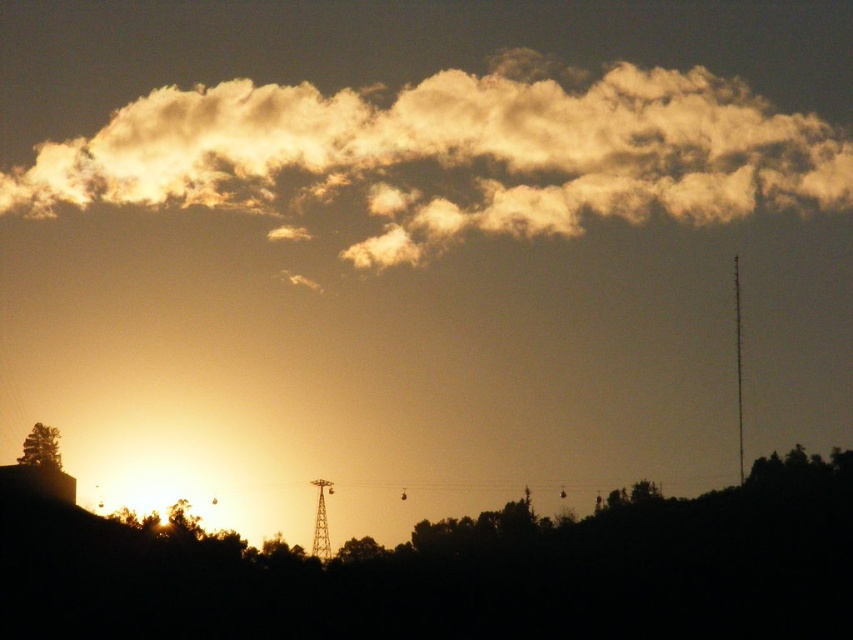
Question: In this image, where is golden fluffy cloud at upper center located relative to green leafy tree at lower left?

Choices:
 (A) left
 (B) right

Answer: (B)

Question: Can you confirm if green leafy tree at lower left is thinner than green matte tree at center?

Choices:
 (A) no
 (B) yes

Answer: (B)

Question: Can you confirm if golden fluffy cloud at upper center is thinner than green leafy tree at lower left?

Choices:
 (A) yes
 (B) no

Answer: (B)

Question: Based on their relative distances, which object is nearer to the green matte tree at center?

Choices:
 (A) golden fluffy cloud at upper center
 (B) green leafy tree at lower left

Answer: (B)

Question: Which object appears closest to the camera in this image?

Choices:
 (A) golden fluffy cloud at upper center
 (B) green leafy tree at lower left

Answer: (A)

Question: Which object is closer to the camera taking this photo?

Choices:
 (A) green leafy tree at lower left
 (B) golden fluffy cloud at upper center

Answer: (B)